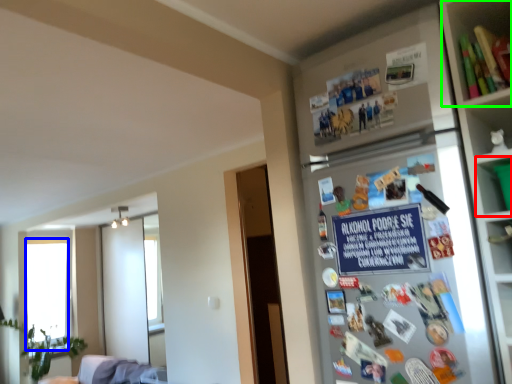
Question: Which object is the closest to the cabinet (highlighted by a red box)? Choose among these: window screen (highlighted by a blue box) or shelf (highlighted by a green box).

Choices:
 (A) window screen
 (B) shelf

Answer: (B)